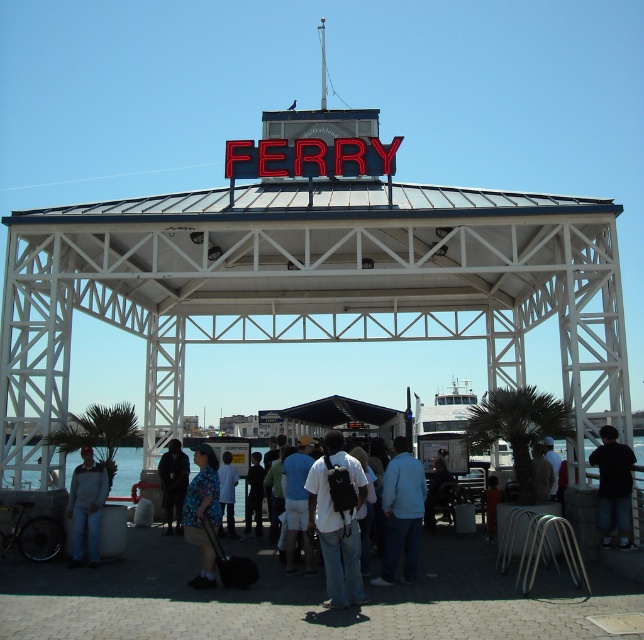
Is blue fabric backpack at center positioned at the back of light brown leather jacket at center?

That is False.

From the picture: Does blue fabric backpack at center appear under light brown leather jacket at center?

Yes, blue fabric backpack at center is below light brown leather jacket at center.

Find the location of `blue fabric backpack at center`. blue fabric backpack at center is located at coordinates (298, 502).

What do you see at coordinates (86, 508) in the screenshot? This screenshot has height=640, width=644. I see `dark blue jeans at lower left` at bounding box center [86, 508].

Can you confirm if dark blue jeans at lower left is positioned to the right of white matte shirt at center?

Incorrect, dark blue jeans at lower left is not on the right side of white matte shirt at center.

Is point (75, 556) positioned before point (222, 512)?

That is True.

The height and width of the screenshot is (640, 644). Find the location of `dark blue jeans at lower left`. dark blue jeans at lower left is located at coordinates (86, 508).

Who is more distant from viewer, (348, 518) or (252, 493)?

The point (252, 493) is behind.

Based on the photo, does matte black backpack at center appear on the right side of dark clothing at center?

Indeed, matte black backpack at center is positioned on the right side of dark clothing at center.

Does point (319, 529) come closer to viewer compared to point (254, 500)?

Yes, point (319, 529) is in front of point (254, 500).

The image size is (644, 640). Find the location of `matte black backpack at center`. matte black backpack at center is located at coordinates (337, 518).